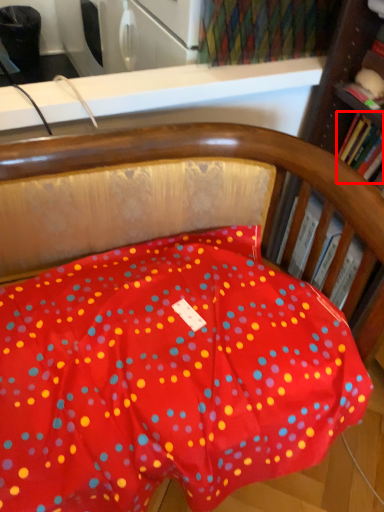
Question: Where is book (annotated by the red box) located in relation to book in the image?

Choices:
 (A) left
 (B) right

Answer: (B)